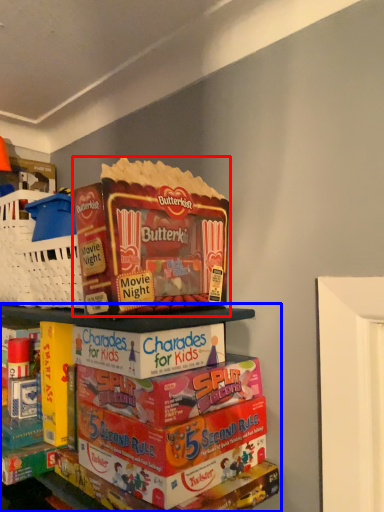
Question: Which of the following is the closest to the observer, product (highlighted by a red box) or shelf (highlighted by a blue box)?

Choices:
 (A) product
 (B) shelf

Answer: (B)